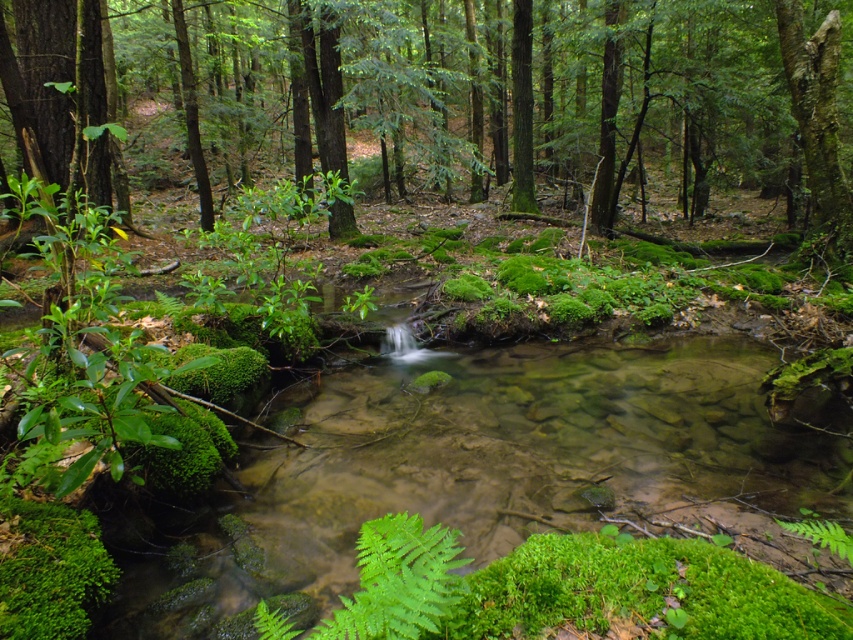
Question: Can you confirm if green mossy tree at center is positioned to the left of green matte tree at left?

Choices:
 (A) no
 (B) yes

Answer: (A)

Question: Among these points, which one is farthest from the camera?

Choices:
 (A) (235, 586)
 (B) (579, 156)
 (C) (45, 17)
 (D) (796, 65)

Answer: (B)

Question: Is green matte tree at left smaller than smooth bark tree at upper right?

Choices:
 (A) yes
 (B) no

Answer: (B)

Question: Which is nearer to the green mossy tree at center?

Choices:
 (A) smooth bark tree at upper right
 (B) clear glass stream at center

Answer: (A)

Question: Is green mossy tree at center above green matte tree at left?

Choices:
 (A) yes
 (B) no

Answer: (A)

Question: Which object is closer to the camera taking this photo?

Choices:
 (A) green mossy tree at center
 (B) clear glass stream at center
 (C) smooth bark tree at upper right

Answer: (B)